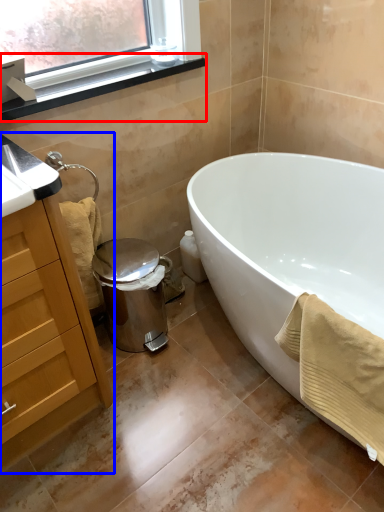
Question: Which point is further to the camera, window sill (highlighted by a red box) or cabinetry (highlighted by a blue box)?

Choices:
 (A) window sill
 (B) cabinetry

Answer: (A)